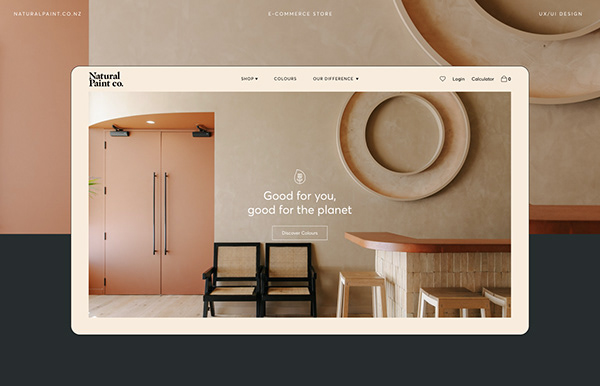
At what (x,y) coordinates should I click in order to perform the action: click on backs of chairs. Please return your answer as a coordinate pair (x, y). The height and width of the screenshot is (386, 600). Looking at the image, I should click on (247, 261), (286, 263).